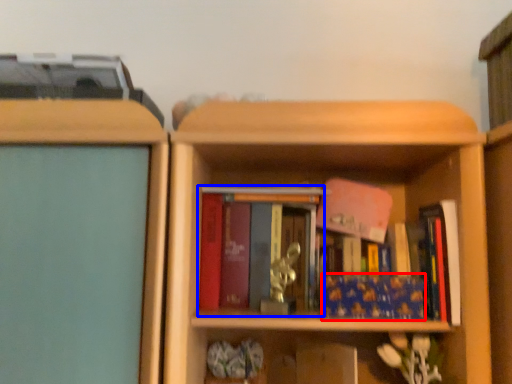
Question: Which object appears closest to the camera in this image, book (highlighted by a red box) or book (highlighted by a blue box)?

Choices:
 (A) book
 (B) book

Answer: (A)